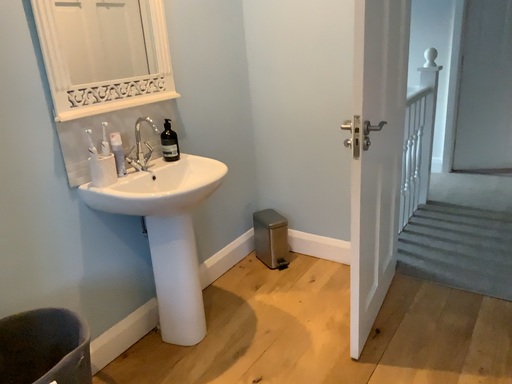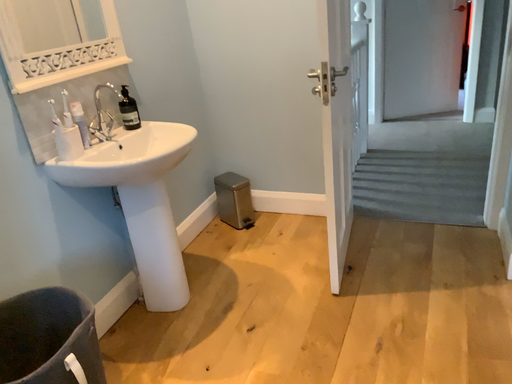
Question: How did the camera likely rotate when shooting the video?

Choices:
 (A) rotated right
 (B) rotated left

Answer: (A)